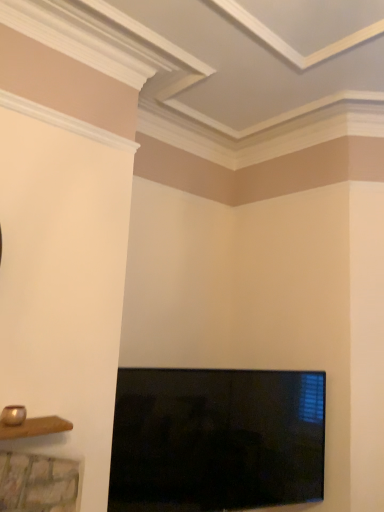
In order to face flat-screen tv at lower center, should I rotate leftwards or rightwards?

You should rotate right by 5.357 degrees.

This screenshot has height=512, width=384. In order to click on flat-screen tv at lower center in this screenshot , I will do `click(216, 439)`.

What do you see at coordinates (216, 439) in the screenshot? I see `flat-screen tv at lower center` at bounding box center [216, 439].

Locate an element on the screen. The width and height of the screenshot is (384, 512). flat-screen tv at lower center is located at coordinates (216, 439).